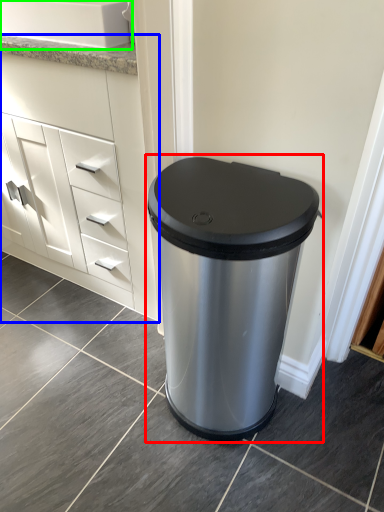
Question: Which is farther away from waste container (highlighted by a red box)? chest of drawers (highlighted by a blue box) or sink (highlighted by a green box)?

Choices:
 (A) chest of drawers
 (B) sink

Answer: (B)